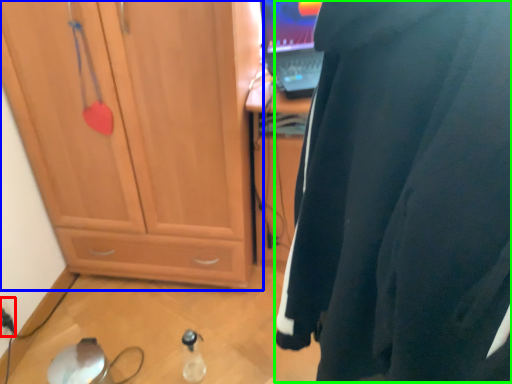
Question: Based on their relative distances, which object is nearer to electric outlet (highlighted by a red box)? Choose from cabinetry (highlighted by a blue box) and wetsuit (highlighted by a green box).

Choices:
 (A) cabinetry
 (B) wetsuit

Answer: (A)